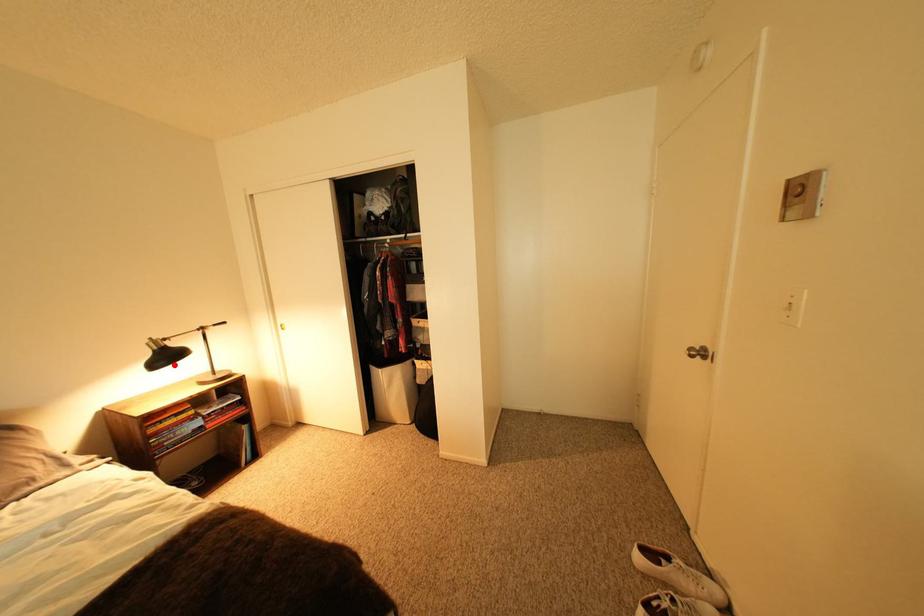
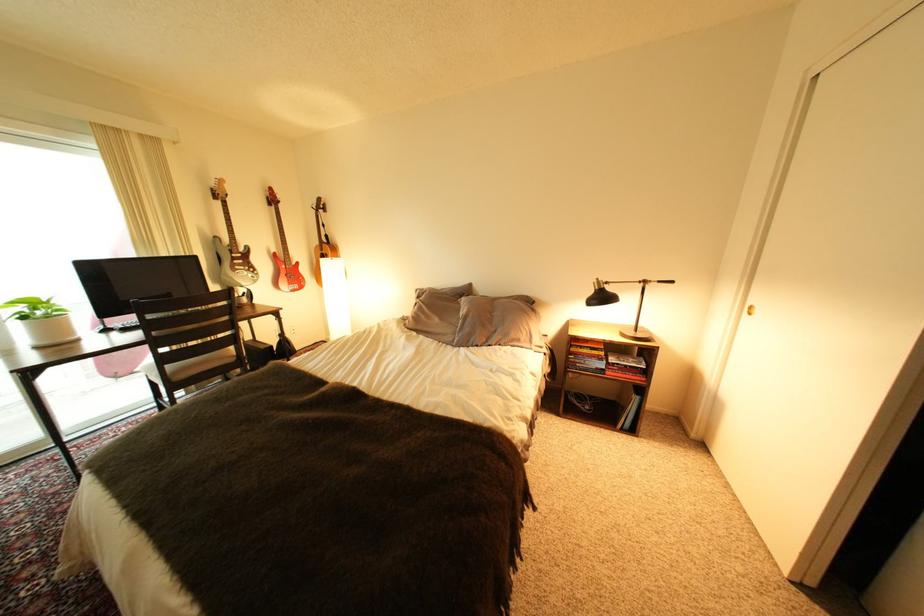
Locate, in the second image, the point that corresponds to the highlighted location in the first image.

(608, 304)